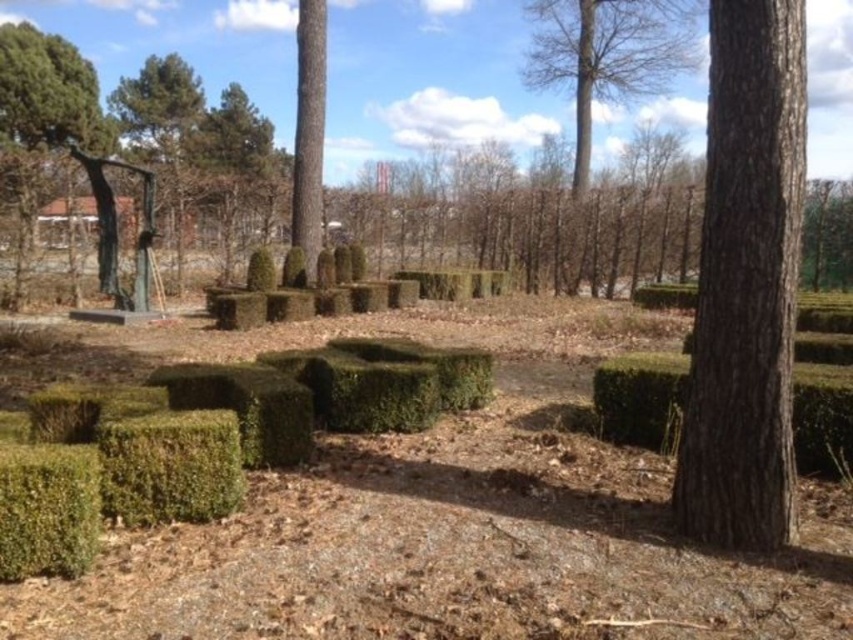
Question: From the image, what is the correct spatial relationship of bare wood tree at upper center in relation to smooth bark tree at center?

Choices:
 (A) below
 (B) above

Answer: (B)

Question: Does green leafy bush at lower left appear over green leafy tree at upper right?

Choices:
 (A) no
 (B) yes

Answer: (A)

Question: Is green textured hedge at center in front of green textured bush at lower left?

Choices:
 (A) yes
 (B) no

Answer: (B)

Question: Based on their relative distances, which object is nearer to the green leafy tree at upper right?

Choices:
 (A) green textured bush at lower left
 (B) smooth bark tree at center
 (C) brown rough bark tree at right

Answer: (A)

Question: Which object is farther from the camera taking this photo?

Choices:
 (A) green textured bush at lower left
 (B) green leafy tree at upper right

Answer: (A)

Question: Among these objects, which one is farthest from the camera?

Choices:
 (A) green textured bush at lower left
 (B) smooth bark tree at center
 (C) green leafy bush at lower left
 (D) brown rough bark tree at right

Answer: (B)